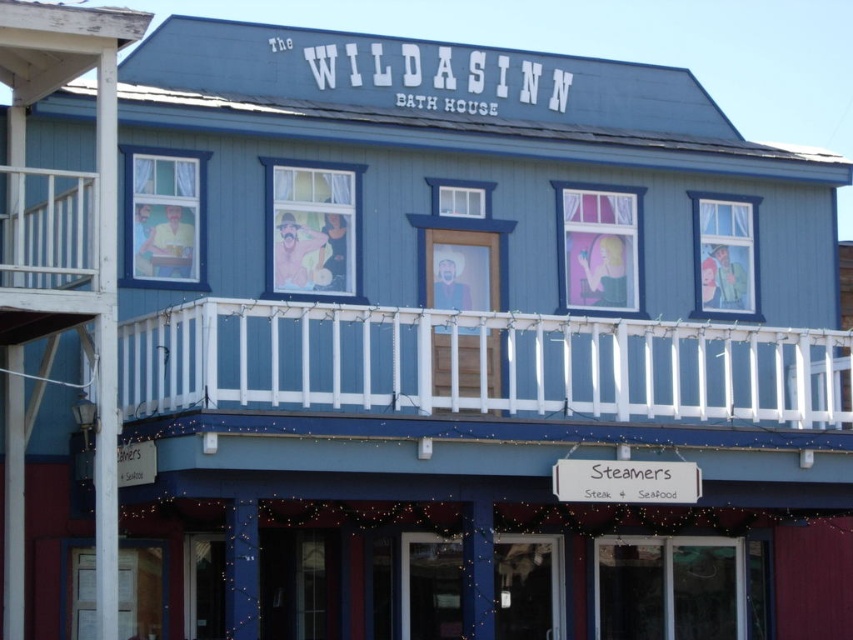
The height and width of the screenshot is (640, 853). In order to click on white painted wood at upper center in this screenshot , I will do `click(479, 364)`.

From the picture: Does white painted wood at upper center appear over white wooden railing at upper left?

No.

At what (x,y) coordinates should I click in order to perform the action: click on white painted wood at upper center. Please return your answer as a coordinate pair (x, y). Looking at the image, I should click on (479, 364).

Identify the location of white painted wood at upper center. Image resolution: width=853 pixels, height=640 pixels. (479, 364).